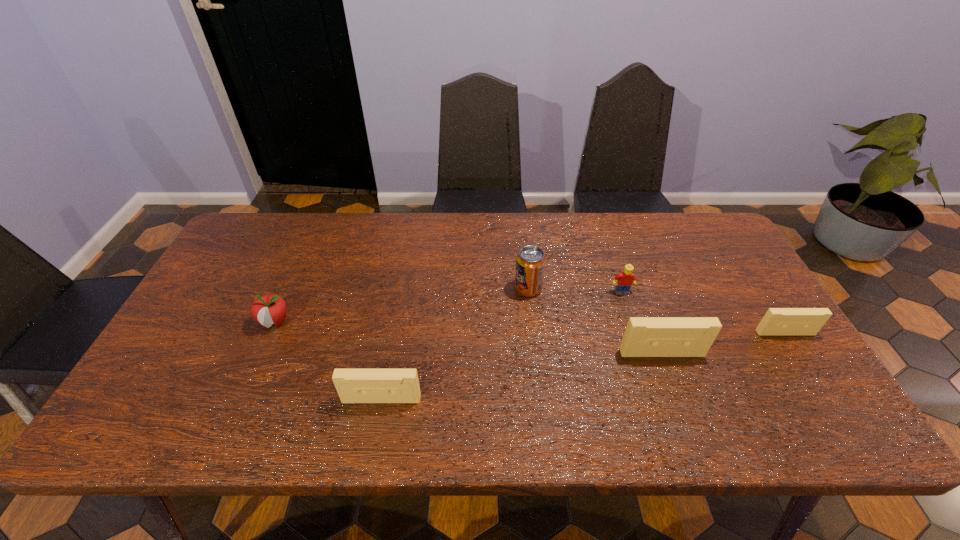
Where is `blank region between the second videotape from left to right and the third object from left to right`? blank region between the second videotape from left to right and the third object from left to right is located at coordinates (595, 321).

Find the location of a particular element. This screenshot has width=960, height=540. object that stands as the closest to the leftmost object is located at coordinates click(353, 385).

Locate which object ranks fifth in proximity to the Lego. Please provide its 2D coordinates. Your answer should be formatted as a tuple, i.e. [(x, y)], where the tuple contains the x and y coordinates of a point satisfying the conditions above.

[(271, 308)]

Locate which videotape ranks second in proximity to the second nearest object. Please provide its 2D coordinates. Your answer should be formatted as a tuple, i.e. [(x, y)], where the tuple contains the x and y coordinates of a point satisfying the conditions above.

[(353, 385)]

Where is `videotape that is the second closest one to the second tallest videotape`? Image resolution: width=960 pixels, height=540 pixels. videotape that is the second closest one to the second tallest videotape is located at coordinates (777, 321).

The image size is (960, 540). In order to click on free spot that satisfies the following two spatial constraints: 1. on the back side of the leftmost object; 2. on the left side of the soda can in this screenshot , I will do `click(290, 289)`.